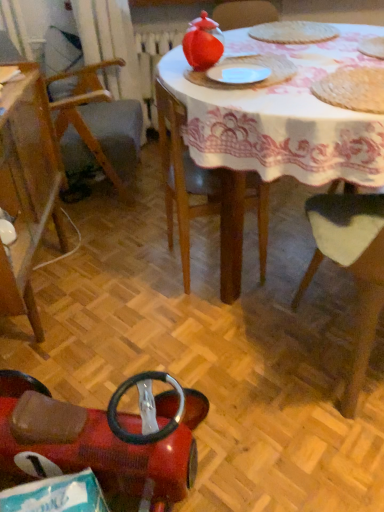
Where is `vacant space behind woven mat at upper right, which is the second food in top-to-bottom order`? This screenshot has height=512, width=384. vacant space behind woven mat at upper right, which is the second food in top-to-bottom order is located at coordinates (319, 62).